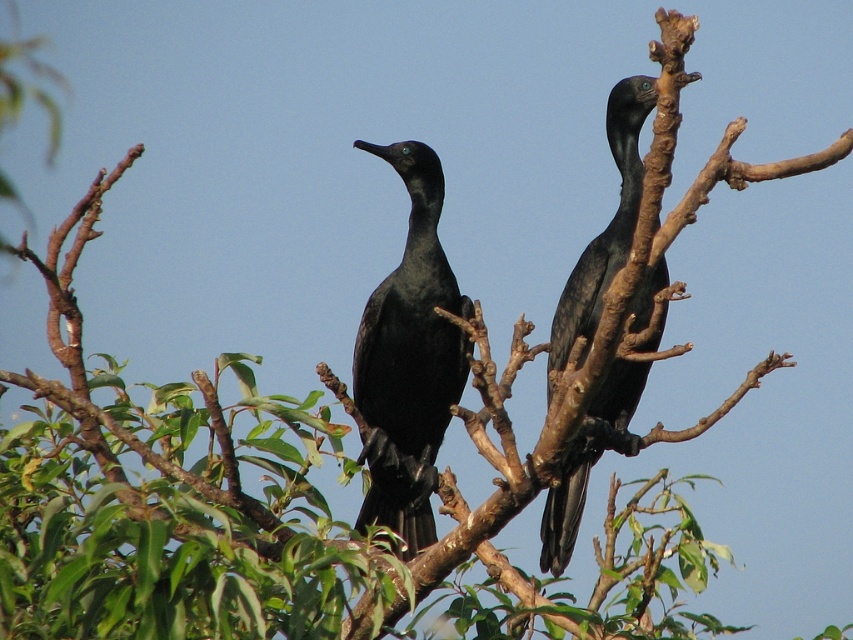
Looking at this image, you are a birdwatcher observing two shiny black birds in a tree. You notice both birds are facing left. Which of the two shiny black birds, the shiny black bird at center or the shiny black bird at upper right, is positioned lower in the tree?

The shiny black bird at center is positioned lower in the tree because it has a lesser height compared to the shiny black bird at upper right.